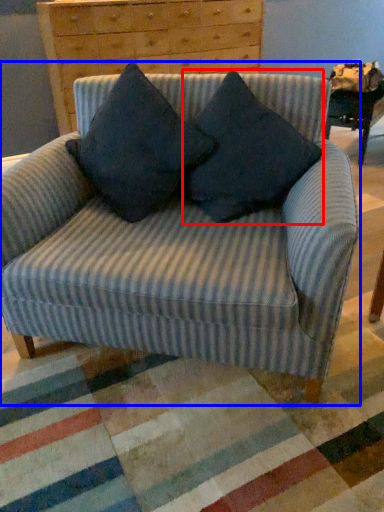
Question: Which of the following is the closest to the observer, pillow (highlighted by a red box) or chair (highlighted by a blue box)?

Choices:
 (A) pillow
 (B) chair

Answer: (B)